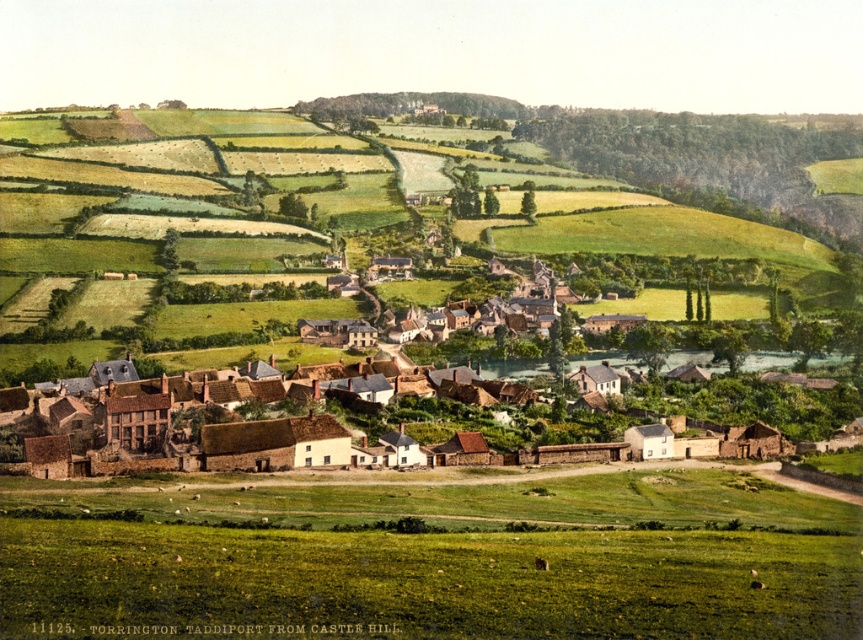
Is green grass at lower center positioned at the back of brown brick houses at center?

No, it is in front of brown brick houses at center.

Is the position of green grass at lower center less distant than that of brown brick houses at center?

That is True.

Which is behind, point (502, 468) or point (565, 307)?

Point (565, 307)

Where is `green grass at lower center`? green grass at lower center is located at coordinates (429, 556).